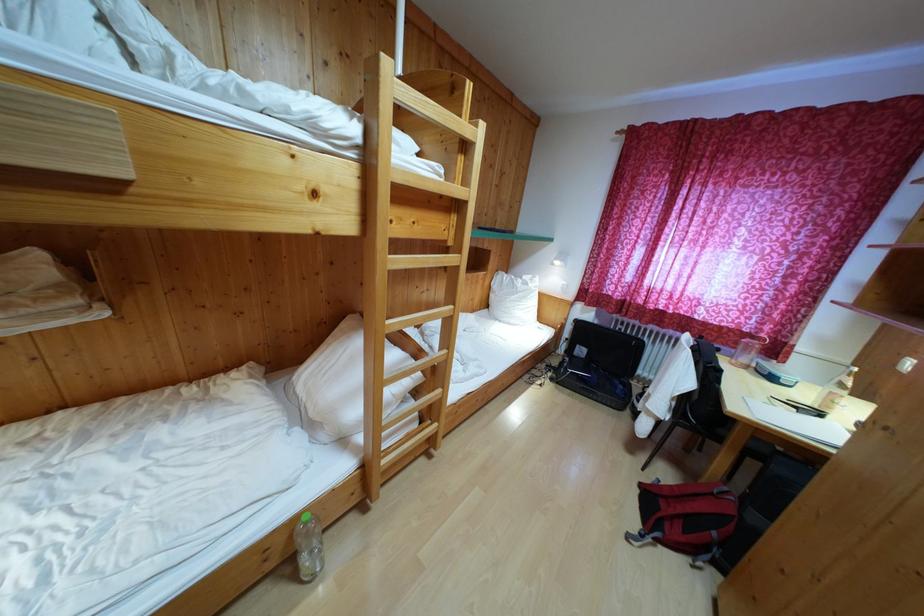
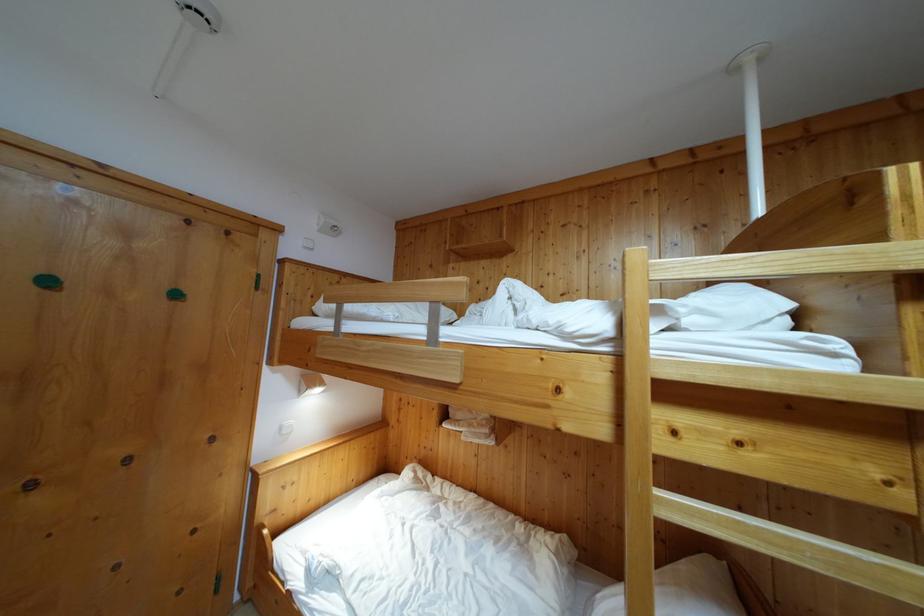
Where in the second image is the point corresponding to (x=394, y=262) from the first image?

(663, 500)